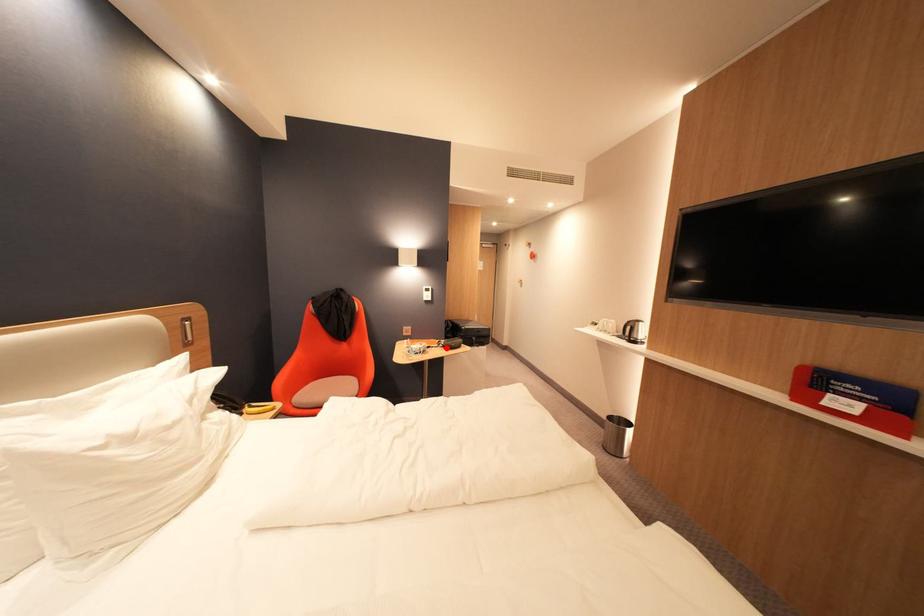
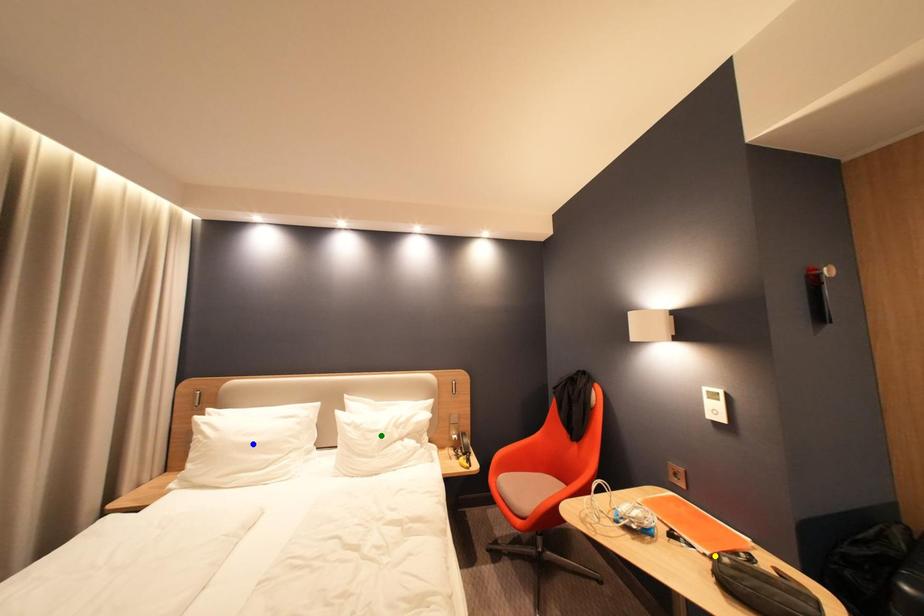
Question: I am providing you with two images of the same scene from different viewpoints. A red point is marked on the first image. You are given multiple points on the second image. Which mark in image 2 goes with the point in image 1?

Choices:
 (A) blue point
 (B) green point
 (C) yellow point

Answer: (C)